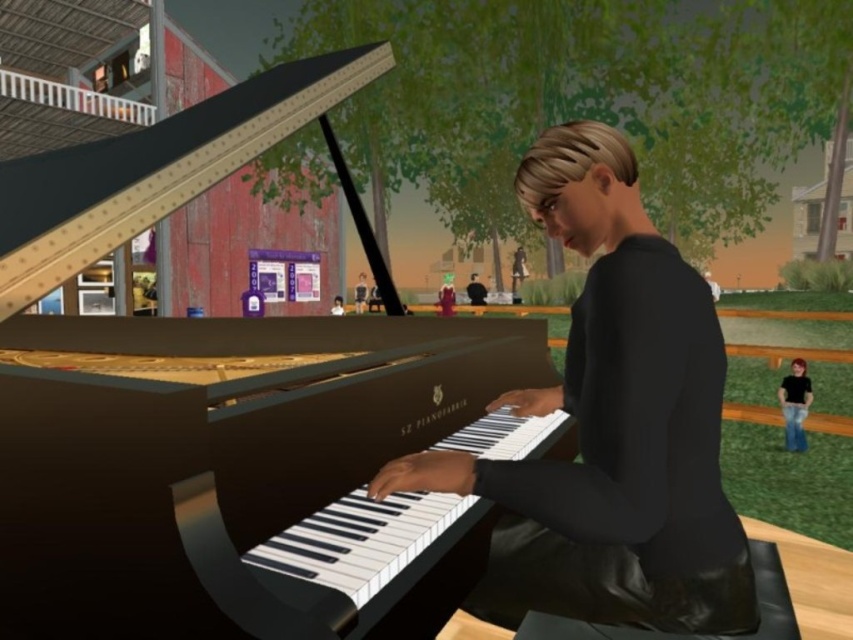
Question: Which point is closer to the camera?

Choices:
 (A) black matte jeans at lower right
 (B) shiny polished wood piano at center
 (C) smooth black sweater at center
 (D) matte black shirt at center

Answer: (B)

Question: Which object is the farthest from the shiny polished wood piano at center?

Choices:
 (A) matte black shirt at center
 (B) smooth black sweater at center
 (C) black matte jeans at lower right

Answer: (A)

Question: Observing the image, what is the correct spatial positioning of smooth black sweater at center in reference to matte black shirt at center?

Choices:
 (A) left
 (B) right

Answer: (A)

Question: Among these points, which one is nearest to the camera?

Choices:
 (A) (796, 365)
 (B) (485, 292)
 (C) (556, 509)

Answer: (C)

Question: Is shiny polished wood piano at center thinner than matte black shirt at center?

Choices:
 (A) no
 (B) yes

Answer: (A)

Question: Is smooth black sweater at center to the right of black matte jeans at lower right from the viewer's perspective?

Choices:
 (A) yes
 (B) no

Answer: (B)